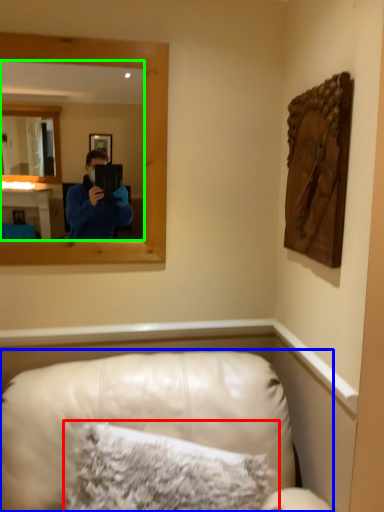
Question: Which object is the closest to the pillow (highlighted by a red box)? Choose among these: furniture (highlighted by a blue box) or mirror (highlighted by a green box).

Choices:
 (A) furniture
 (B) mirror

Answer: (A)